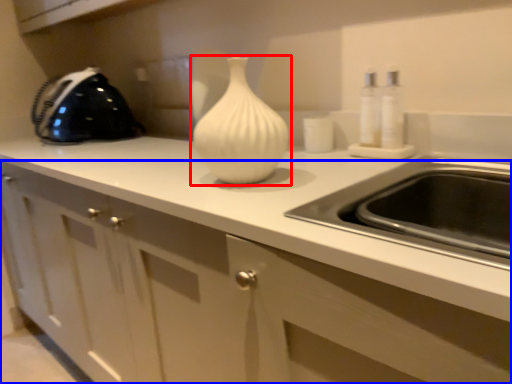
Question: Which point is closer to the camera, vase (highlighted by a red box) or cabinetry (highlighted by a blue box)?

Choices:
 (A) vase
 (B) cabinetry

Answer: (B)